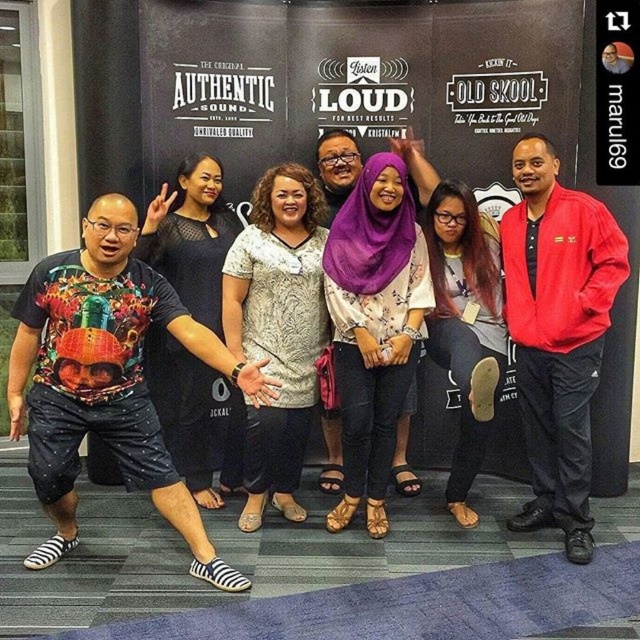
In the photo, there are two women wearing a purple floral blouse at center and a black mesh dress at center. Which one is shorter in length?

The purple floral blouse at center is shorter than the black mesh dress at center.

You are a photographer trying to adjust the lighting for a photo shoot. You notice the black mesh dress at center and the purple fabric hijab at center. Which object requires more light to ensure it is well illuminated?

The black mesh dress at center has a larger size compared to the purple fabric hijab at center, so it requires more light to ensure proper illumination.

You are a photographer standing 1.5 meters away from the backdrop. You want to focus your camera on the purple floral blouse at center. Is the blouse within the camera lens range of 2 meters? Please explain.

The purple floral blouse at center is 3.11 meters from viewer. Since the photographer is standing 1.5 meters away from the backdrop, the total distance between the photographer and the blouse would be more than 1.5 meters. Therefore, the blouse is beyond the camera lens range of 2 meters.